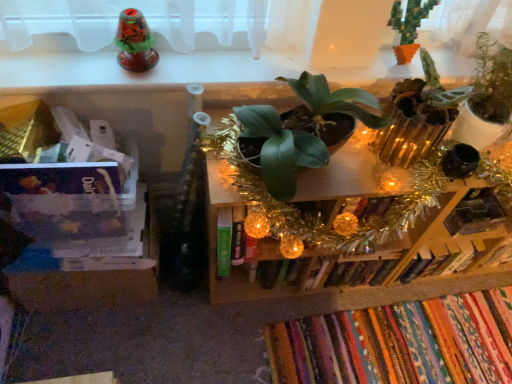
Consider the image. What is the approximate width of clear plastic container at left, which appears as the second shelf when viewed from the right?

clear plastic container at left, which appears as the second shelf when viewed from the right, is 11.76 inches wide.

Where is `hardcover book at center-right, which ranks as the 2th book in bottom-to-top order`? This screenshot has width=512, height=384. hardcover book at center-right, which ranks as the 2th book in bottom-to-top order is located at coordinates (455, 259).

You are a GUI agent. You are given a task and a screenshot of the screen. Output one action in this format:
    pyautogui.click(x=<x>, y=<y>)
    Task: Click on the green leafy plant at center, arranged as the second shelf when viewed from the left
    
    Given the screenshot: What is the action you would take?
    pyautogui.click(x=356, y=255)

Where is `green matte plant at upper right, placed as the 1th houseplant when sorted from right to left`? The width and height of the screenshot is (512, 384). green matte plant at upper right, placed as the 1th houseplant when sorted from right to left is located at coordinates (487, 96).

The width and height of the screenshot is (512, 384). Find the location of `multicolored woven rug at lower right, placed as the 2th book when sorted from top to bottom`. multicolored woven rug at lower right, placed as the 2th book when sorted from top to bottom is located at coordinates (398, 344).

Identify the location of clear plastic container at left, placed as the 1th shelf when sorted from left to right. The height and width of the screenshot is (384, 512). (91, 267).

Is clear plastic container at left, placed as the 1th shelf when sorted from left to right, at the right side of green matte plant at upper right, the 3th houseplant viewed from the left?

Incorrect, clear plastic container at left, placed as the 1th shelf when sorted from left to right, is not on the right side of green matte plant at upper right, the 3th houseplant viewed from the left.

Is point (142, 277) more distant than point (482, 37)?

That is True.

The width and height of the screenshot is (512, 384). In order to click on the 2nd shelf below when counting from the green matte plant at upper right, the 3th houseplant viewed from the left (from the image's perspective) in this screenshot , I will do `click(91, 267)`.

Based on the photo, would you say hardcover book at center-right, which ranks as the 2th book in bottom-to-top order, is outside green leafy plant at center, arranged as the second shelf when viewed from the left?

Yes, hardcover book at center-right, which ranks as the 2th book in bottom-to-top order, is outside of green leafy plant at center, arranged as the second shelf when viewed from the left.

From a real-world perspective, is hardcover book at center-right, which ranks as the 2th book in bottom-to-top order, positioned over green leafy plant at center, arranged as the second shelf when viewed from the left, based on gravity?

No, from a real-world perspective, hardcover book at center-right, which ranks as the 2th book in bottom-to-top order, is not above green leafy plant at center, arranged as the second shelf when viewed from the left.

Does hardcover book at center-right, which ranks as the 2th book in bottom-to-top order, touch green leafy plant at center, the 1th shelf from the right?

They are not placed beside each other.

Between point (505, 118) and point (293, 134), which one is positioned in front?

The point (293, 134) is in front.

Visually, is green matte plant at upper right, placed as the 1th houseplant when sorted from right to left, positioned to the left or to the right of green matte plant at center, which ranks as the first houseplant in left-to-right order?

green matte plant at upper right, placed as the 1th houseplant when sorted from right to left, is positioned on green matte plant at center, which ranks as the first houseplant in left-to-right order,'s right side.

This screenshot has height=384, width=512. In the image, there is a green matte plant at upper right, the 3th houseplant viewed from the left. What are the coordinates of `houseplant below it (from a real-world perspective)` in the screenshot? It's located at (302, 129).

From the image's perspective, which one is positioned lower, green matte plant at upper right, placed as the 1th houseplant when sorted from right to left, or green matte plant at center, the 3th houseplant from the right?

From the image's view, green matte plant at center, the 3th houseplant from the right, is below.

Is green pixelated cactus at upper right, the second houseplant when ordered from left to right, at the back of hardcover book at center-right, which ranks as the 2th book in bottom-to-top order?

No.

Is hardcover book at center-right, which ranks as the 2th book in bottom-to-top order, positioned far away from green pixelated cactus at upper right, the second houseplant when ordered from left to right?

No, hardcover book at center-right, which ranks as the 2th book in bottom-to-top order, is not far away from green pixelated cactus at upper right, the second houseplant when ordered from left to right.

Considering the relative sizes of hardcover book at center-right, which ranks as the 2th book in bottom-to-top order, and green pixelated cactus at upper right, the second houseplant when ordered from left to right, in the image provided, is hardcover book at center-right, which ranks as the 2th book in bottom-to-top order, shorter than green pixelated cactus at upper right, the second houseplant when ordered from left to right,?

Indeed, hardcover book at center-right, which ranks as the 2th book in bottom-to-top order, has a lesser height compared to green pixelated cactus at upper right, the second houseplant when ordered from left to right.

Does hardcover book at center-right, the 1th book viewed from the top, lie in front of green pixelated cactus at upper right, which is the 2th houseplant in right-to-left order?

No, hardcover book at center-right, the 1th book viewed from the top, is further to the viewer.

Is multicolored woven rug at lower right, marked as the first book in a bottom-to-top arrangement, looking in the opposite direction of clear plastic container at left, which appears as the second shelf when viewed from the right?

multicolored woven rug at lower right, marked as the first book in a bottom-to-top arrangement, is not turned away from clear plastic container at left, which appears as the second shelf when viewed from the right.

Considering the positions of objects multicolored woven rug at lower right, placed as the 2th book when sorted from top to bottom, and clear plastic container at left, placed as the 1th shelf when sorted from left to right, in the image provided, who is in front, multicolored woven rug at lower right, placed as the 2th book when sorted from top to bottom, or clear plastic container at left, placed as the 1th shelf when sorted from left to right,?

clear plastic container at left, placed as the 1th shelf when sorted from left to right, is closer to the camera.

Looking at the image, does multicolored woven rug at lower right, placed as the 2th book when sorted from top to bottom, seem bigger or smaller compared to clear plastic container at left, which appears as the second shelf when viewed from the right?

In the image, multicolored woven rug at lower right, placed as the 2th book when sorted from top to bottom, appears to be smaller than clear plastic container at left, which appears as the second shelf when viewed from the right.

Does multicolored woven rug at lower right, placed as the 2th book when sorted from top to bottom, contain clear plastic container at left, placed as the 1th shelf when sorted from left to right?

No, clear plastic container at left, placed as the 1th shelf when sorted from left to right, is not inside multicolored woven rug at lower right, placed as the 2th book when sorted from top to bottom.

Is clear plastic container at left, which appears as the second shelf when viewed from the right, next to green matte plant at center, which ranks as the first houseplant in left-to-right order, and touching it?

No, clear plastic container at left, which appears as the second shelf when viewed from the right, is not in contact with green matte plant at center, which ranks as the first houseplant in left-to-right order.

Which is more distant, (40, 307) or (376, 115)?

Point (40, 307)

From the picture: Which of these two, clear plastic container at left, placed as the 1th shelf when sorted from left to right, or green matte plant at center, the 3th houseplant from the right, stands shorter?

green matte plant at center, the 3th houseplant from the right, is shorter.

Is green matte plant at center, the 3th houseplant from the right, at the back of clear plastic container at left, placed as the 1th shelf when sorted from left to right?

No, green matte plant at center, the 3th houseplant from the right, is not at the back of clear plastic container at left, placed as the 1th shelf when sorted from left to right.

Looking at this image, looking at the image, does green pixelated cactus at upper right, the second houseplant when ordered from left to right, seem bigger or smaller compared to green matte plant at center, the 3th houseplant from the right?

In the image, green pixelated cactus at upper right, the second houseplant when ordered from left to right, appears to be smaller than green matte plant at center, the 3th houseplant from the right.

Is green pixelated cactus at upper right, the second houseplant when ordered from left to right, oriented away from green matte plant at center, the 3th houseplant from the right?

No, green matte plant at center, the 3th houseplant from the right, is not at the back of green pixelated cactus at upper right, the second houseplant when ordered from left to right.

What's the angular difference between green pixelated cactus at upper right, which is the 2th houseplant in right-to-left order, and green matte plant at center, the 3th houseplant from the right,'s facing directions?

The angular difference between green pixelated cactus at upper right, which is the 2th houseplant in right-to-left order, and green matte plant at center, the 3th houseplant from the right, is 0.339 degrees.

Between point (401, 16) and point (365, 91), which one is positioned in front?

The point (401, 16) is in front.

Identify the location of shelf that is the 2nd one when counting leftward from the green matte plant at upper right, the 3th houseplant viewed from the left. (91, 267).

From the image's perspective, which book is the 1st one below the green leafy plant at center, the 1th shelf from the right? Please provide its 2D coordinates.

[(455, 259)]

When comparing their distances from hardcover book at center-right, which ranks as the 2th book in bottom-to-top order, does clear plastic container at left, which appears as the second shelf when viewed from the right, or green leafy plant at center, the 1th shelf from the right, seem closer?

Based on the image, green leafy plant at center, the 1th shelf from the right, appears to be nearer to hardcover book at center-right, which ranks as the 2th book in bottom-to-top order.

Which object lies further to the anchor point green matte plant at upper right, the 3th houseplant viewed from the left, green matte plant at center, the 3th houseplant from the right, or green pixelated cactus at upper right, the second houseplant when ordered from left to right?

green matte plant at center, the 3th houseplant from the right, is further to green matte plant at upper right, the 3th houseplant viewed from the left.

Considering their positions, is green leafy plant at center, arranged as the second shelf when viewed from the left, positioned further to green matte plant at upper right, placed as the 1th houseplant when sorted from right to left, than green pixelated cactus at upper right, which is the 2th houseplant in right-to-left order?

green leafy plant at center, arranged as the second shelf when viewed from the left, is positioned further to the anchor green matte plant at upper right, placed as the 1th houseplant when sorted from right to left.

Estimate the real-world distances between objects in this image. Which object is closer to green pixelated cactus at upper right, which is the 2th houseplant in right-to-left order, green matte plant at upper right, the 3th houseplant viewed from the left, or green matte plant at center, the 3th houseplant from the right?

The object closer to green pixelated cactus at upper right, which is the 2th houseplant in right-to-left order, is green matte plant at upper right, the 3th houseplant viewed from the left.

Looking at the image, which one is located further to clear plastic container at left, placed as the 1th shelf when sorted from left to right, hardcover book at center-right, which ranks as the 2th book in bottom-to-top order, or green leafy plant at center, arranged as the second shelf when viewed from the left?

The object further to clear plastic container at left, placed as the 1th shelf when sorted from left to right, is hardcover book at center-right, which ranks as the 2th book in bottom-to-top order.

In the scene shown: Which object lies nearer to the anchor point green matte plant at upper right, placed as the 1th houseplant when sorted from right to left, hardcover book at center-right, which ranks as the 2th book in bottom-to-top order, or green matte plant at center, which ranks as the first houseplant in left-to-right order?

green matte plant at center, which ranks as the first houseplant in left-to-right order, is positioned closer to the anchor green matte plant at upper right, placed as the 1th houseplant when sorted from right to left.

Considering their positions, is green matte plant at center, which ranks as the first houseplant in left-to-right order, positioned closer to multicolored woven rug at lower right, marked as the first book in a bottom-to-top arrangement, than green pixelated cactus at upper right, which is the 2th houseplant in right-to-left order?

The object closer to multicolored woven rug at lower right, marked as the first book in a bottom-to-top arrangement, is green matte plant at center, which ranks as the first houseplant in left-to-right order.

Based on their spatial positions, is green pixelated cactus at upper right, which is the 2th houseplant in right-to-left order, or clear plastic container at left, which appears as the second shelf when viewed from the right, closer to hardcover book at center-right, the 1th book viewed from the top?

green pixelated cactus at upper right, which is the 2th houseplant in right-to-left order, is closer to hardcover book at center-right, the 1th book viewed from the top.

The width and height of the screenshot is (512, 384). Identify the location of book between green matte plant at center, which ranks as the first houseplant in left-to-right order, and hardcover book at center-right, which ranks as the 2th book in bottom-to-top order, in the front-back direction. (398, 344).

Identify the location of book between green matte plant at upper right, placed as the 1th houseplant when sorted from right to left, and multicolored woven rug at lower right, placed as the 2th book when sorted from top to bottom, vertically. The height and width of the screenshot is (384, 512). (455, 259).

You are a GUI agent. You are given a task and a screenshot of the screen. Output one action in this format:
    pyautogui.click(x=<x>, y=<y>)
    Task: Click on the shelf between green matte plant at center, which ranks as the first houseplant in left-to-right order, and green matte plant at upper right, placed as the 1th houseplant when sorted from right to left, from left to right
    
    Given the screenshot: What is the action you would take?
    pyautogui.click(x=356, y=255)

The height and width of the screenshot is (384, 512). In order to click on shelf between clear plastic container at left, placed as the 1th shelf when sorted from left to right, and hardcover book at center-right, the 1th book viewed from the top in this screenshot , I will do click(356, 255).